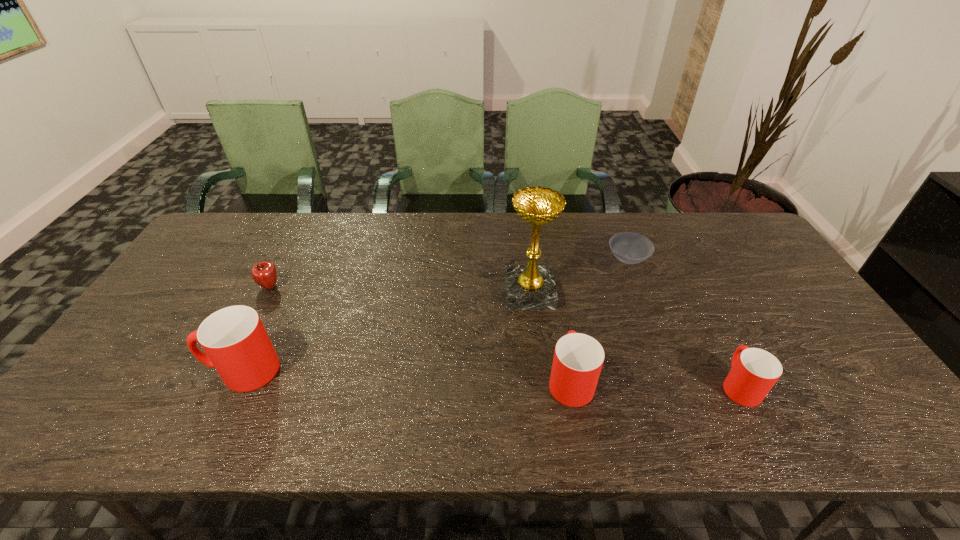
Please point a space for a new cup to maintain equal intervals. Please provide its 2D coordinates. Your answer should be formatted as a tuple, i.e. [(x, y)], where the tuple contains the x and y coordinates of a point satisfying the conditions above.

[(404, 375)]